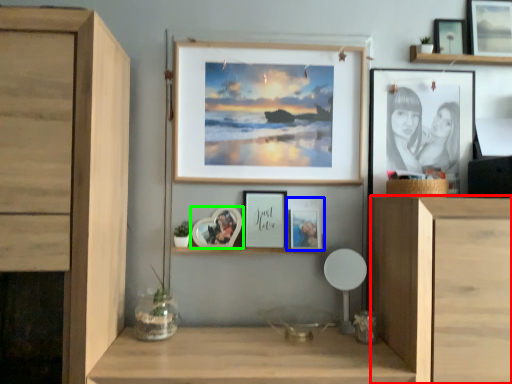
Question: Estimate the real-world distances between objects in this image. Which object is closer to cabinetry (highlighted by a red box), picture frame (highlighted by a blue box) or picture frame (highlighted by a green box)?

Choices:
 (A) picture frame
 (B) picture frame

Answer: (A)